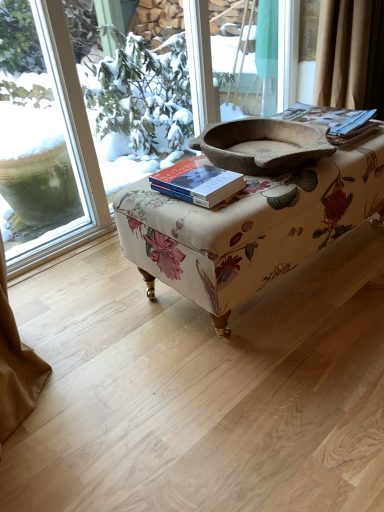
Question: Is hardcover book at center, the first paperback book positioned from the left, closer to camera compared to floral fabric ottoman at center?

Choices:
 (A) yes
 (B) no

Answer: (B)

Question: Is hardcover book at center, which is the 2th paperback book in back-to-front order, smaller than floral fabric ottoman at center?

Choices:
 (A) yes
 (B) no

Answer: (A)

Question: Does hardcover book at center, which appears as the 1th paperback book when ordered from the bottom, have a greater height compared to floral fabric ottoman at center?

Choices:
 (A) yes
 (B) no

Answer: (B)

Question: Can you confirm if hardcover book at center, which appears as the 1th paperback book when ordered from the bottom, is thinner than floral fabric ottoman at center?

Choices:
 (A) yes
 (B) no

Answer: (A)

Question: Considering the relative positions of hardcover book at center, the first paperback book positioned from the left, and floral fabric ottoman at center in the image provided, is hardcover book at center, the first paperback book positioned from the left, behind floral fabric ottoman at center?

Choices:
 (A) yes
 (B) no

Answer: (A)

Question: From a real-world perspective, is hardcover book at center, the second paperback book positioned from the right, physically above floral fabric ottoman at center?

Choices:
 (A) no
 (B) yes

Answer: (B)

Question: Is matte brown book at upper right, which is the 2th paperback book in front-to-back order, facing away from rustic wooden bowl at center?

Choices:
 (A) no
 (B) yes

Answer: (A)

Question: From a real-world perspective, does matte brown book at upper right, acting as the first paperback book starting from the right, sit lower than rustic wooden bowl at center?

Choices:
 (A) yes
 (B) no

Answer: (A)

Question: Is matte brown book at upper right, placed as the first paperback book when sorted from top to bottom, directly adjacent to rustic wooden bowl at center?

Choices:
 (A) no
 (B) yes

Answer: (A)

Question: From the image's perspective, is matte brown book at upper right, the 2th paperback book ordered from the bottom, located beneath rustic wooden bowl at center?

Choices:
 (A) yes
 (B) no

Answer: (B)

Question: Can you confirm if matte brown book at upper right, acting as the first paperback book starting from the right, is thinner than rustic wooden bowl at center?

Choices:
 (A) yes
 (B) no

Answer: (A)

Question: From a real-world perspective, is matte brown book at upper right, the 2th paperback book ordered from the bottom, positioned over rustic wooden bowl at center based on gravity?

Choices:
 (A) no
 (B) yes

Answer: (A)

Question: From the image's perspective, is matte brown book at upper right, acting as the 1th paperback book starting from the back, located above transparent glass window at upper left?

Choices:
 (A) no
 (B) yes

Answer: (A)